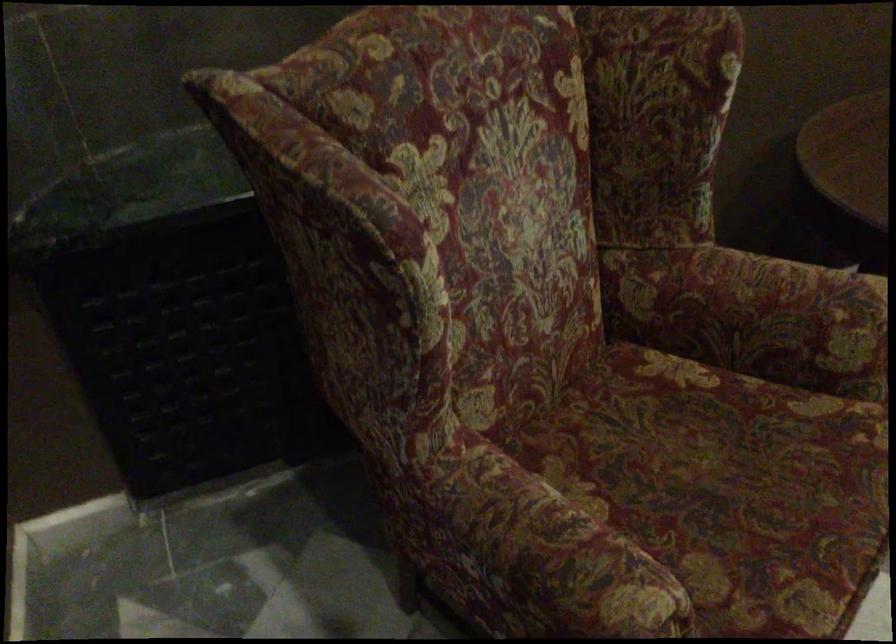
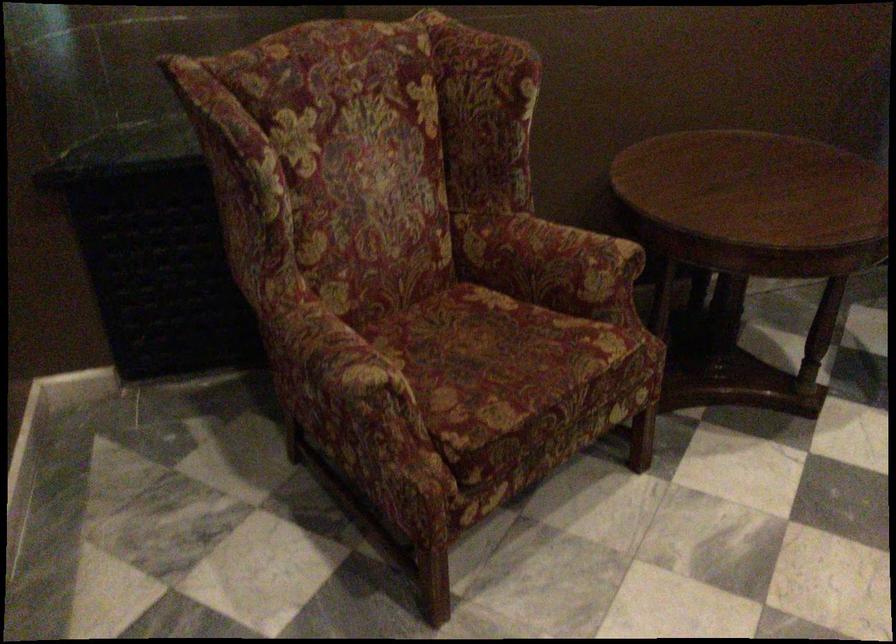
Locate, in the second image, the point that corresponds to pixel 800 308 in the first image.

(572, 256)